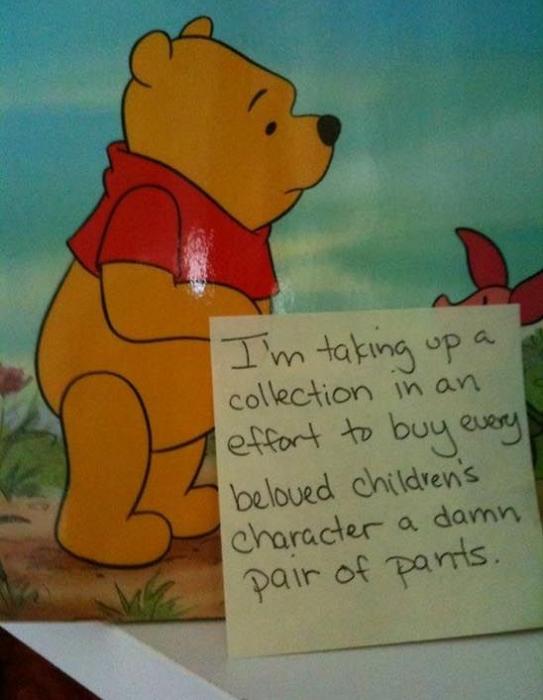
Where is `table`? The image size is (543, 700). table is located at coordinates (338, 661).